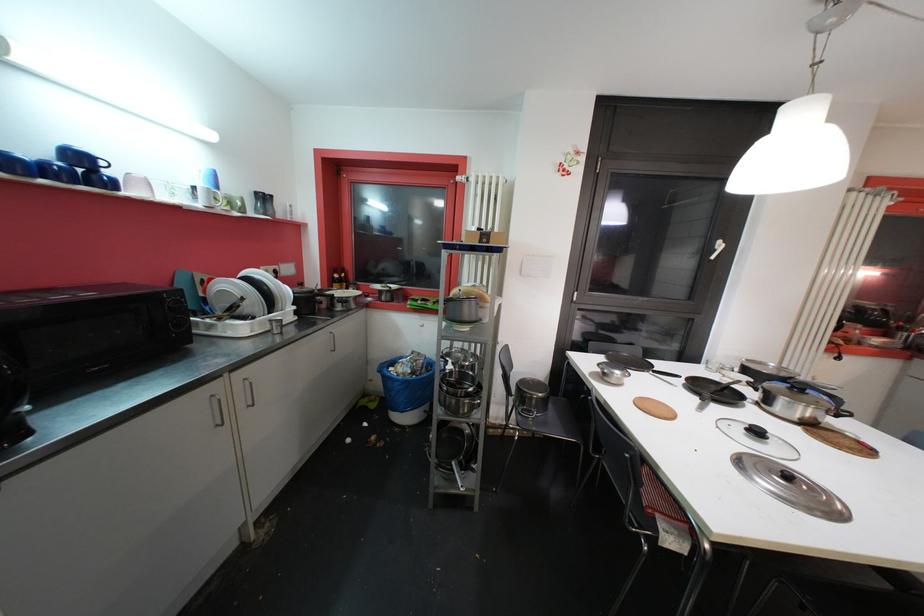
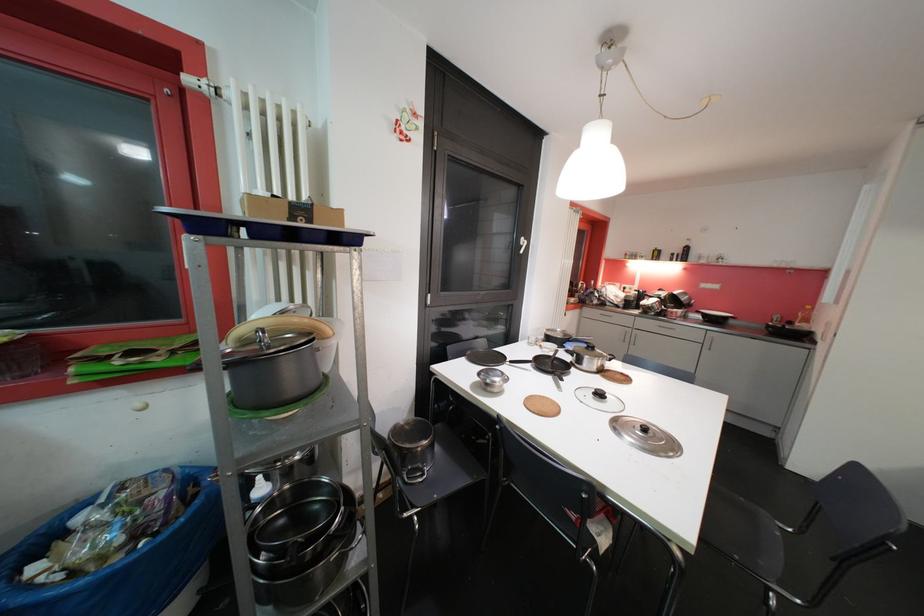
Find the pixel in the second image that matches pixel 793 479 in the first image.

(650, 432)